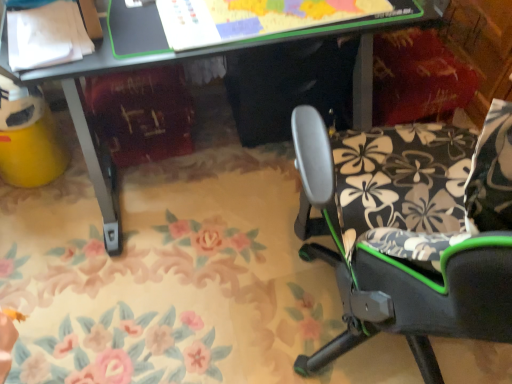
Question: In terms of width, does matte black desk at center look wider or thinner when compared to black fabric chair at right?

Choices:
 (A) wide
 (B) thin

Answer: (A)

Question: Do you think matte black desk at center is within black fabric chair at right, or outside of it?

Choices:
 (A) outside
 (B) inside

Answer: (A)

Question: In the image, is matte black desk at center positioned in front of or behind black fabric chair at right?

Choices:
 (A) behind
 (B) front

Answer: (A)

Question: Considering the positions of black fabric chair at right and matte black desk at center in the image, is black fabric chair at right wider or thinner than matte black desk at center?

Choices:
 (A) wide
 (B) thin

Answer: (B)

Question: Considering the relative positions of black fabric chair at right and matte black desk at center in the image provided, is black fabric chair at right to the left or to the right of matte black desk at center?

Choices:
 (A) left
 (B) right

Answer: (B)

Question: From the image's perspective, is black fabric chair at right above or below matte black desk at center?

Choices:
 (A) above
 (B) below

Answer: (B)

Question: In the image, is black fabric chair at right positioned in front of or behind matte black desk at center?

Choices:
 (A) front
 (B) behind

Answer: (A)